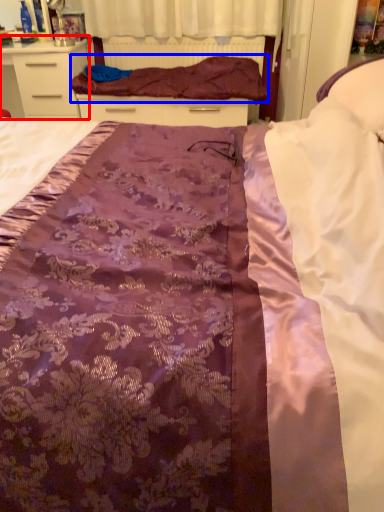
Question: Among these objects, which one is farthest to the camera, chest of drawers (highlighted by a red box) or blanket (highlighted by a blue box)?

Choices:
 (A) chest of drawers
 (B) blanket

Answer: (A)